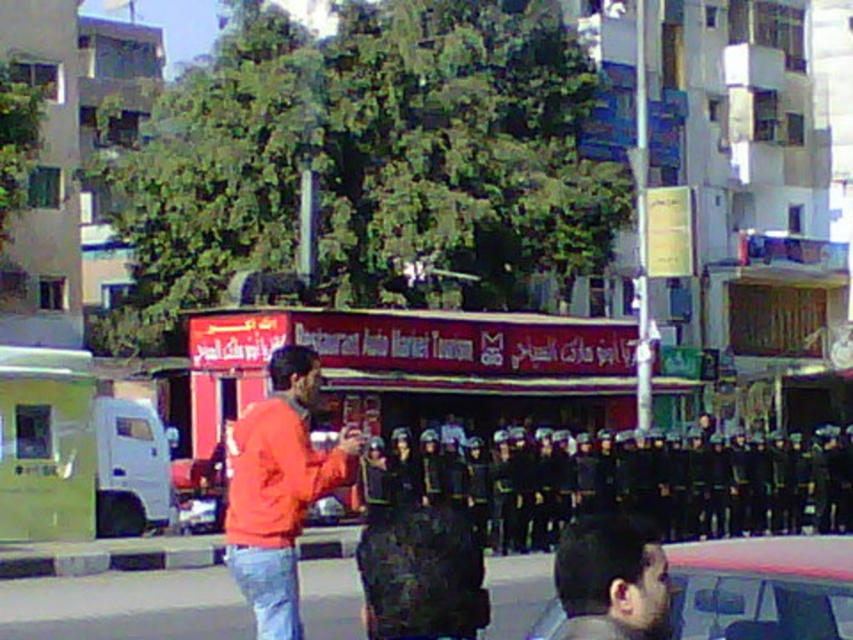
You are a photographer trying to capture a clear shot of the orange matte jacket at center and the smooth black hair at lower right. Which object should you zoom in on to ensure it fills the frame better?

The orange matte jacket at center is larger in size than the smooth black hair at lower right, so you should zoom in on the orange matte jacket at center to ensure it fills the frame better.

You are a delivery person who needs to drop off a package at the building with the red signboard. The red matte food truck at center is blocking the entrance. Can you go around the truck to reach the building?

The red matte food truck at center is positioned at point [418,368], so you can go around it to reach the building as long as there is space on either side of the truck.